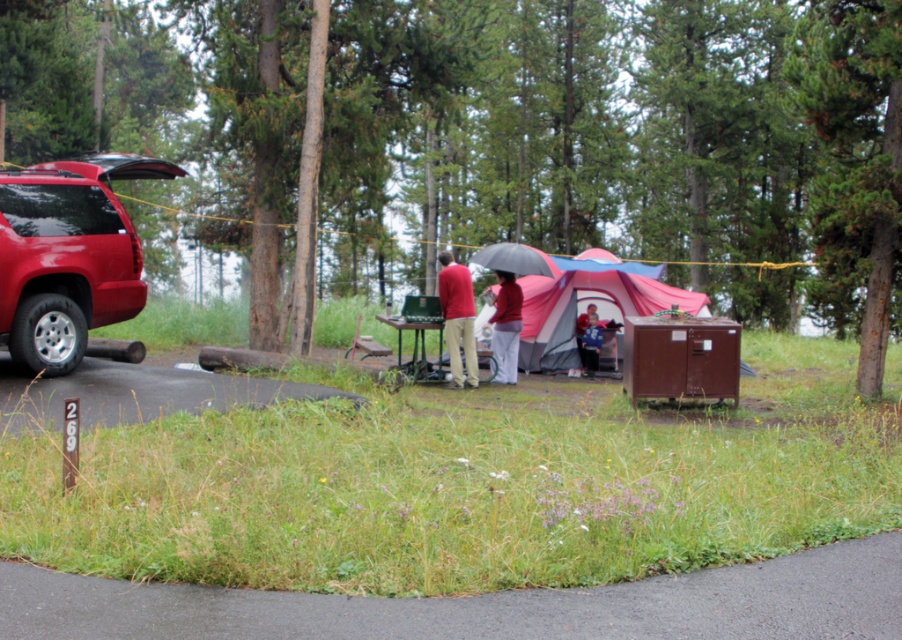
You are a hiker who wants to take a photo of the shiny red suv at left and the matte red shirt at center. Since you want both subjects to be in focus, you need to adjust your camera settings. Which subject should you focus on to ensure both are sharp?

The shiny red suv at left is positioned over matte red shirt at center, so focusing on the shiny red suv at left will keep both in focus.

You are standing at the center of the image and want to locate the pink fabric tent at center. According to the coordinates provided, in which direction should you look to find it?

The pink fabric tent at center is located at coordinates point (587, 305), so you should look slightly to the left and downward from the very center of the image to find it.